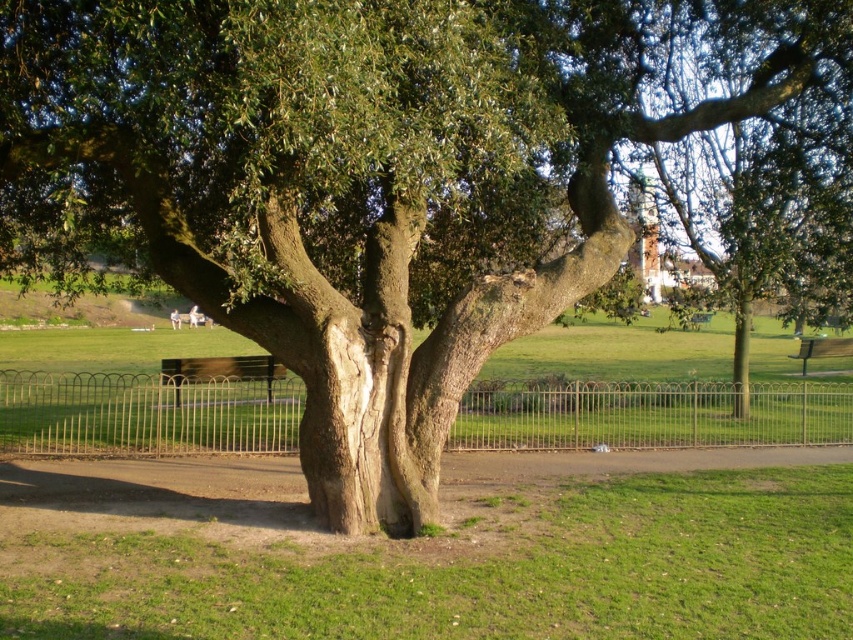
Between brown wooden bench at center and wooden park bench at lower right, which one has more height?

Standing taller between the two is wooden park bench at lower right.

Can you confirm if brown wooden bench at center is shorter than wooden park bench at lower right?

Correct, brown wooden bench at center is not as tall as wooden park bench at lower right.

Is point (228, 378) farther from viewer compared to point (827, 339)?

No, it is not.

This screenshot has height=640, width=853. Find the location of `brown wooden bench at center`. brown wooden bench at center is located at coordinates (221, 369).

Can you confirm if metallic silver fence at center is bigger than wooden park bench at lower right?

Indeed, metallic silver fence at center has a larger size compared to wooden park bench at lower right.

Does metallic silver fence at center have a lesser width compared to wooden park bench at lower right?

Incorrect, metallic silver fence at center's width is not less than wooden park bench at lower right's.

This screenshot has height=640, width=853. Identify the location of metallic silver fence at center. (648, 416).

Is the position of metallic silver fence at center less distant than that of brown wooden bench at center?

Yes, metallic silver fence at center is in front of brown wooden bench at center.

Image resolution: width=853 pixels, height=640 pixels. Find the location of `metallic silver fence at center`. metallic silver fence at center is located at coordinates (648, 416).